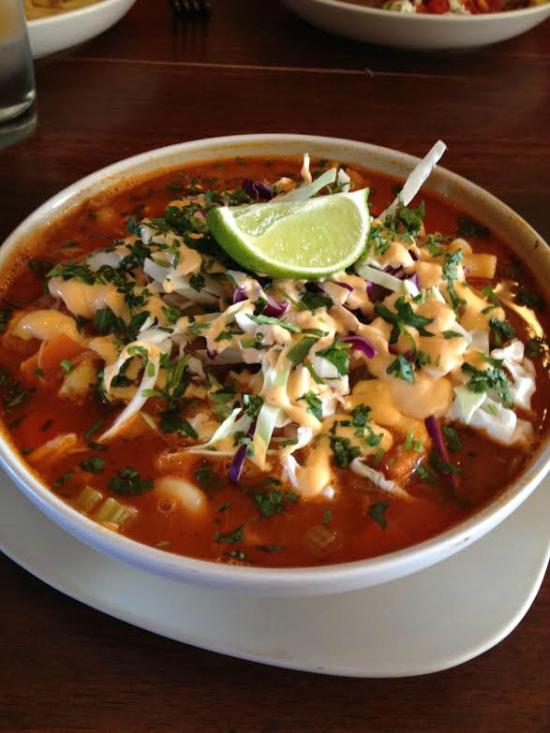
Where is `bowl`? Image resolution: width=550 pixels, height=733 pixels. bowl is located at coordinates (384, 28).